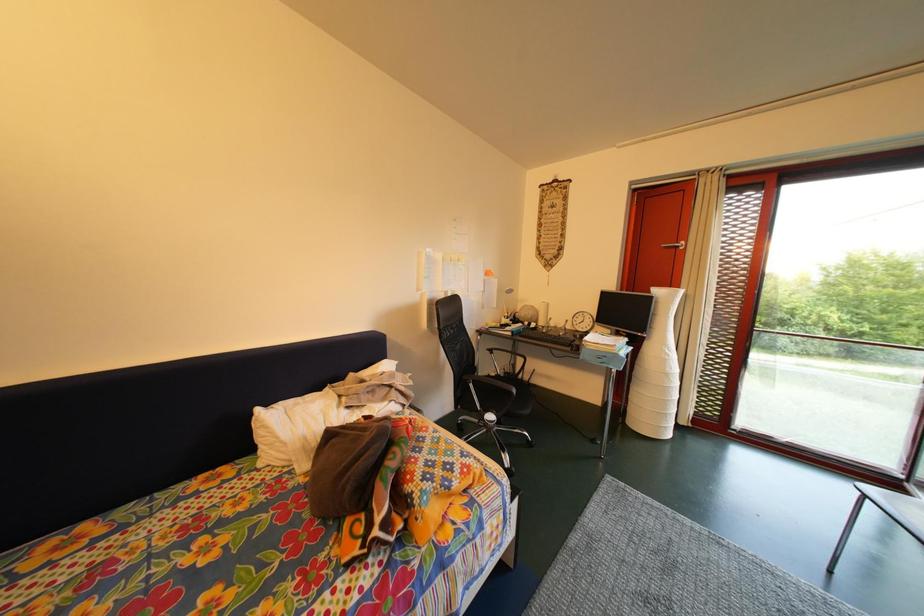
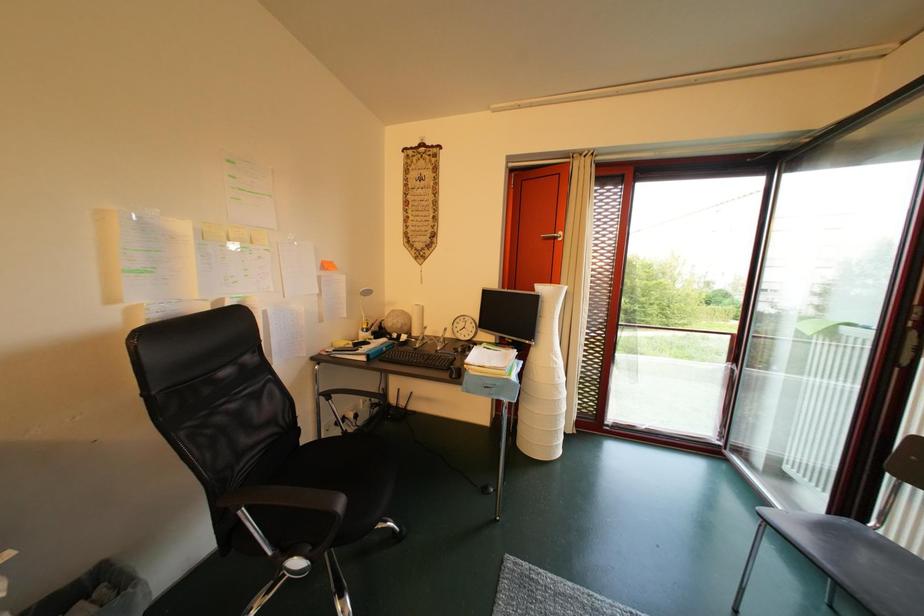
What movement of the cameraman would produce the second image?

The movement direction of the cameraman is right, forward.